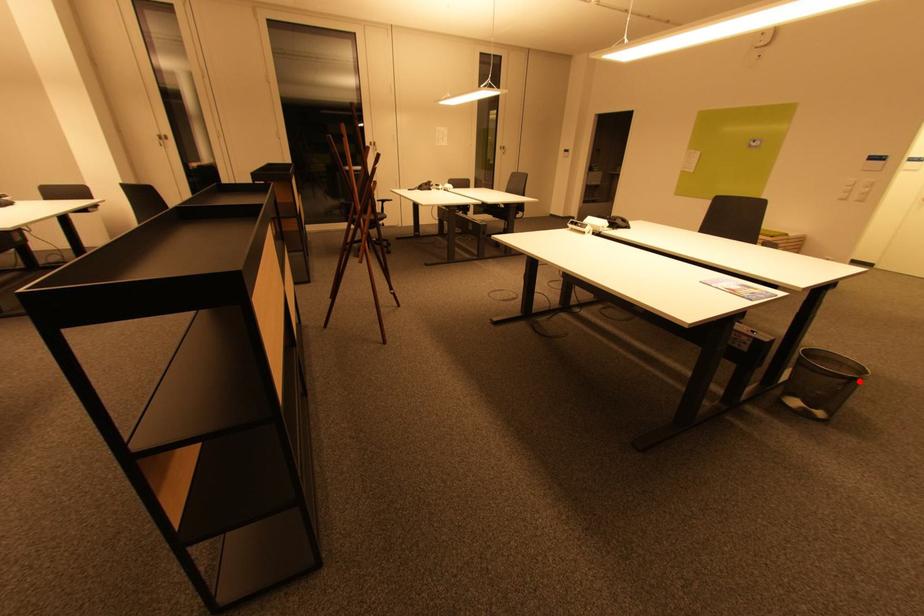
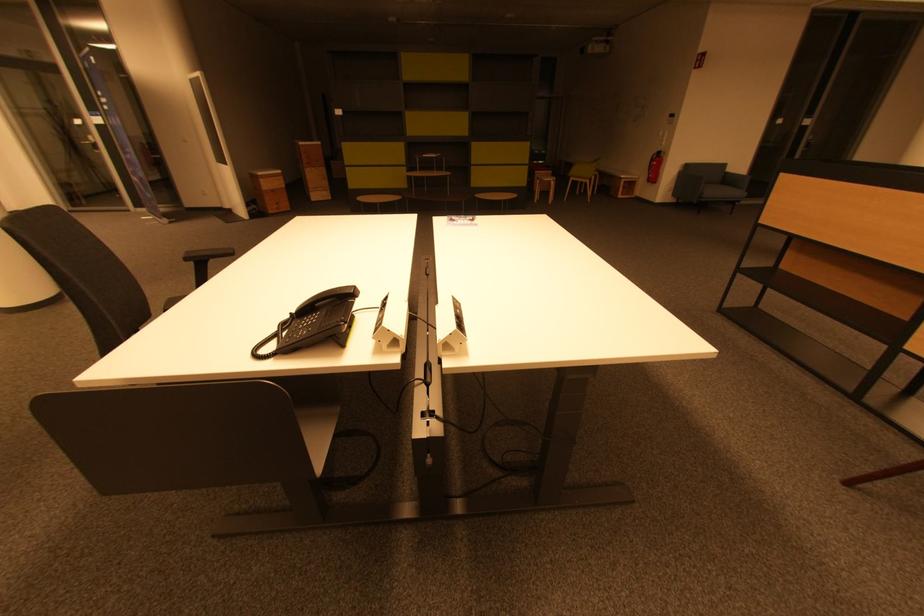
Question: I am providing you with two images of the same scene from different viewpoints. A red point is marked on the first image. Is the red point's position out of view in image 2?

Choices:
 (A) Yes
 (B) No

Answer: (A)